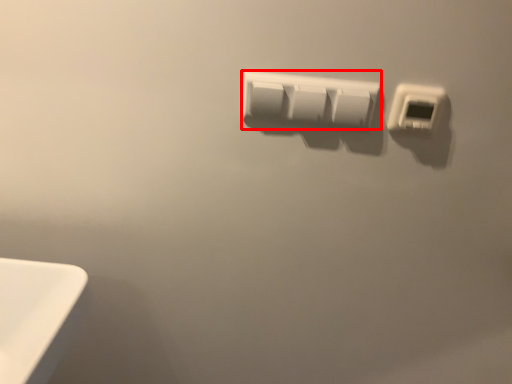
Question: From the image's perspective, what is the correct spatial positioning of power plugs and sockets (annotated by the red box) in reference to power plugs and sockets?

Choices:
 (A) below
 (B) above

Answer: (B)